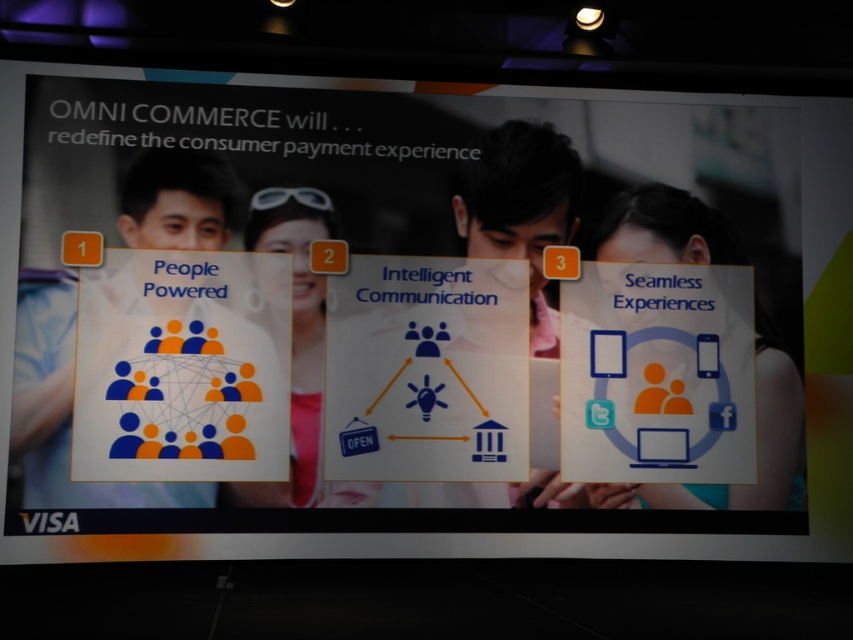
Question: Is blue matte people at left in front of matte orange figure at center?

Choices:
 (A) no
 (B) yes

Answer: (B)

Question: Is blue matte people at left above matte orange figure at center?

Choices:
 (A) no
 (B) yes

Answer: (A)

Question: Among these objects, which one is nearest to the camera?

Choices:
 (A) matte black man at center
 (B) blue matte people at left
 (C) matte orange figure at center

Answer: (B)

Question: Which point is closer to the camera?

Choices:
 (A) (300, 202)
 (B) (622, 250)
 (C) (152, 228)

Answer: (C)

Question: Estimate the real-world distances between objects in this image. Which object is closer to the blue matte people at left?

Choices:
 (A) matte black man at center
 (B) matte orange woman at center
 (C) matte orange figure at center

Answer: (C)

Question: Does matte orange woman at center have a larger size compared to matte orange figure at center?

Choices:
 (A) no
 (B) yes

Answer: (A)